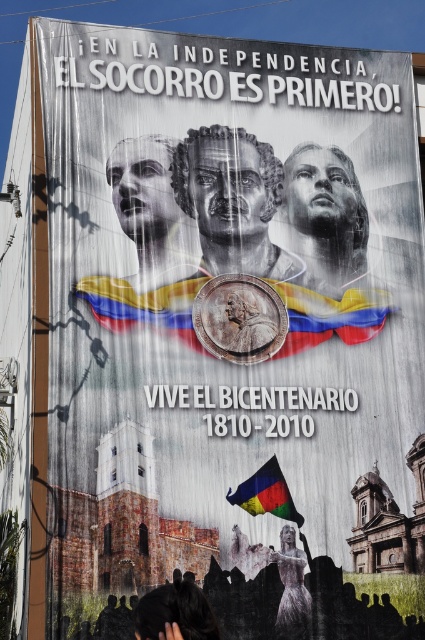
From the picture: You are an art student analyzing the billboard. You notice two central elements, the grayscale sculpture at center and the polished metallic coin at center. Which one is positioned to the right?

The polished metallic coin at center is positioned to the right of the grayscale sculpture at center.

You are a photographer standing in front of the billboard. You want to take a photo that focuses on the silvery metallic dress at center without the multicolored fabric flag at center being too prominent in the frame. What adjustment should you make to your camera angle?

Since the silvery metallic dress at center is closer to the viewer than the multicolored fabric flag at center, you can lower your camera angle to position the dress in the foreground while angling the shot downward to minimize the visibility of the flag behind it.